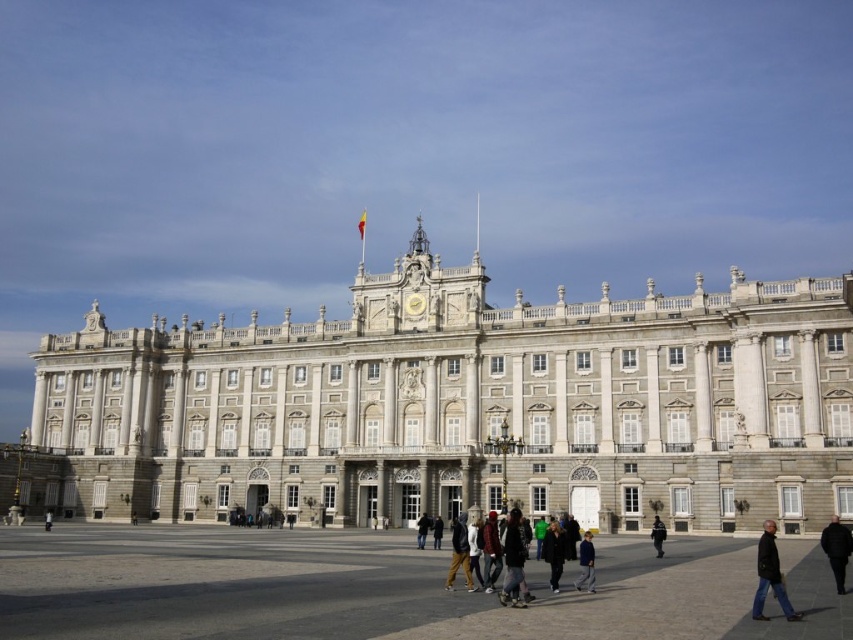
Can you confirm if gray concrete plaza at lower center is bigger than black fabric jacket at lower right?

Yes.

Is point (526, 632) behind point (840, 576)?

No, (526, 632) is closer to viewer.

At what (x,y) coordinates should I click in order to perform the action: click on gray concrete plaza at lower center. Please return your answer as a coordinate pair (x, y). Looking at the image, I should click on click(381, 588).

Can you confirm if black leather jacket at lower right is taller than dark blue jacket at center?

Yes, black leather jacket at lower right is taller than dark blue jacket at center.

This screenshot has width=853, height=640. Describe the element at coordinates (769, 576) in the screenshot. I see `black leather jacket at lower right` at that location.

Identify the location of black leather jacket at lower right. pyautogui.click(x=769, y=576).

Does dark gray hoodie at center have a greater width compared to dark gray coat at center?

In fact, dark gray hoodie at center might be narrower than dark gray coat at center.

Who is more forward, (514, 580) or (549, 572)?

Positioned in front is point (514, 580).

Find the location of a particular element. dark gray hoodie at center is located at coordinates (512, 561).